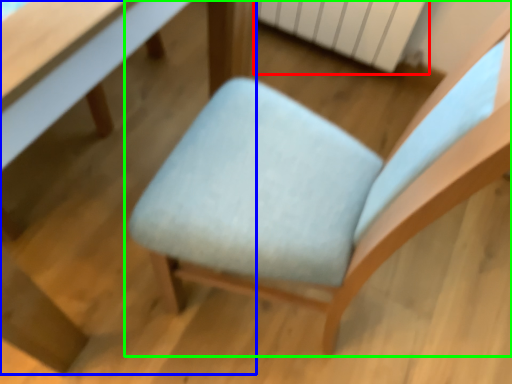
Question: Which is nearer to the radiator (highlighted by a red box)? table (highlighted by a blue box) or chair (highlighted by a green box).

Choices:
 (A) table
 (B) chair

Answer: (B)